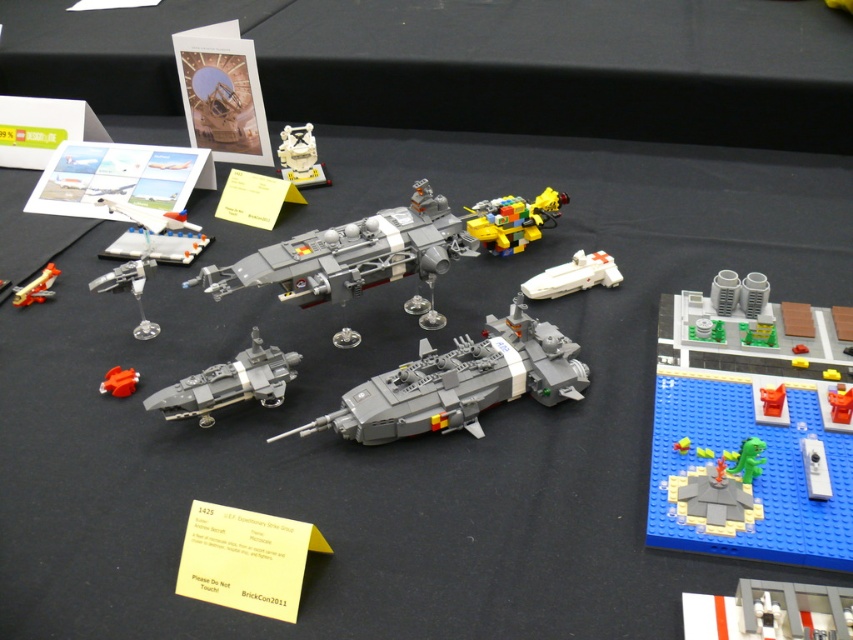
You are a curator arranging a LEGO exhibition. You need to place a new display stand that must be positioned exactly at point (351, 253). What object is currently located at that point?

The matte gray spaceship at center is located at point (351, 253).

What is located at the coordinates point [750,428] in the image?

The green plastic dinosaur at center is located at point [750,428].